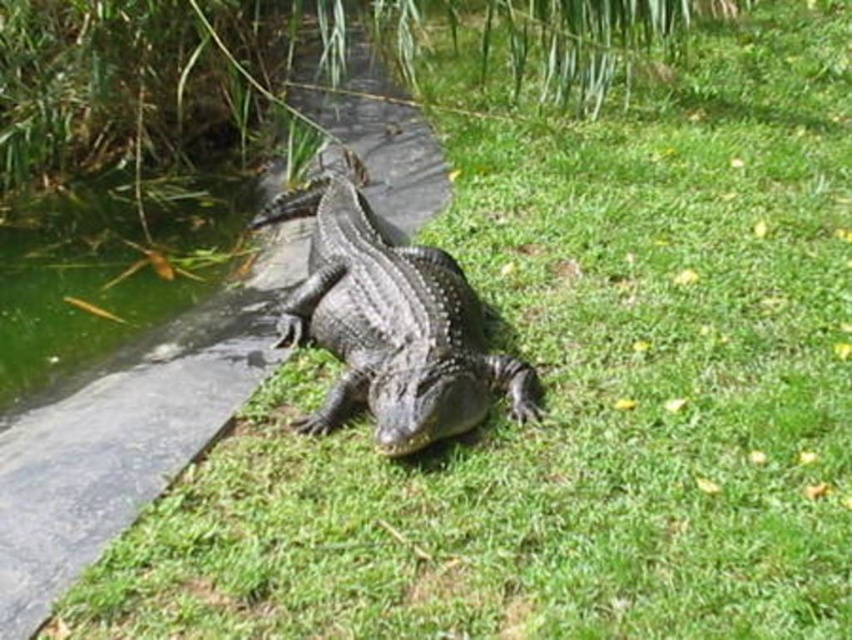
Question: From the image, what is the correct spatial relationship of shiny dark green crocodile at center in relation to green algae water at lower left?

Choices:
 (A) below
 (B) above

Answer: (A)

Question: Among these objects, which one is farthest from the camera?

Choices:
 (A) shiny dark green crocodile at center
 (B) green algae water at lower left

Answer: (B)

Question: Does shiny dark green crocodile at center lie behind green algae water at lower left?

Choices:
 (A) yes
 (B) no

Answer: (B)

Question: Does shiny dark green crocodile at center come behind green algae water at lower left?

Choices:
 (A) yes
 (B) no

Answer: (B)

Question: Which point is closer to the camera taking this photo?

Choices:
 (A) (401, 353)
 (B) (136, 326)

Answer: (A)